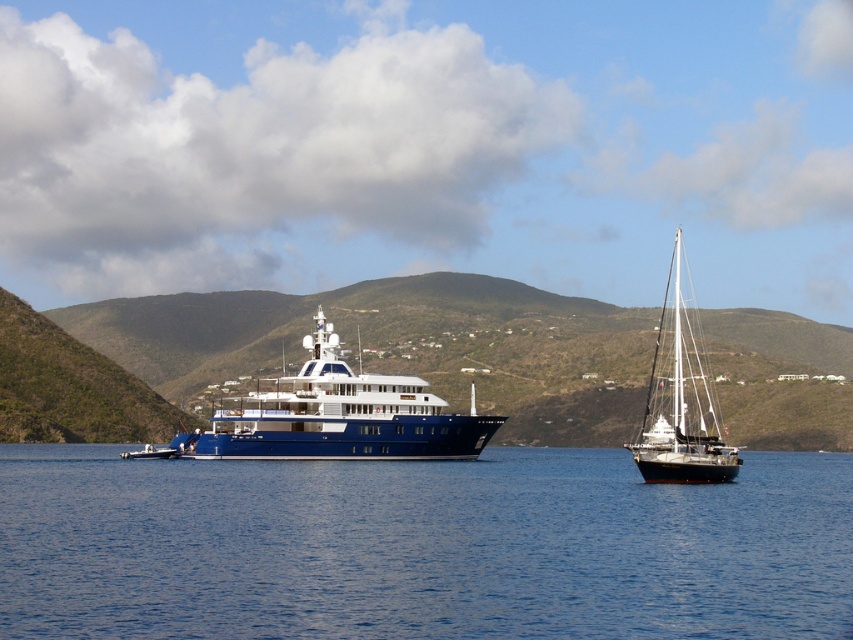
You are a sailor planning to dock your boat at the port located between the shiny blue yacht at center and the black matte sailboat at right. Which vessel should you approach first to reach the port safely?

You should approach the shiny blue yacht at center first because it is positioned to the left of the black matte sailboat at right, meaning the port is likely located between them, and approaching the yacht first would place you closer to the port entrance.

You are a marine biologist planning to board the shiny blue yacht at center and the black matte sailboat at right for research. Considering their sizes, which vessel will require more space to dock due to its larger width?

The black matte sailboat at right requires more space to dock because its width is greater than the shiny blue yacht at center.